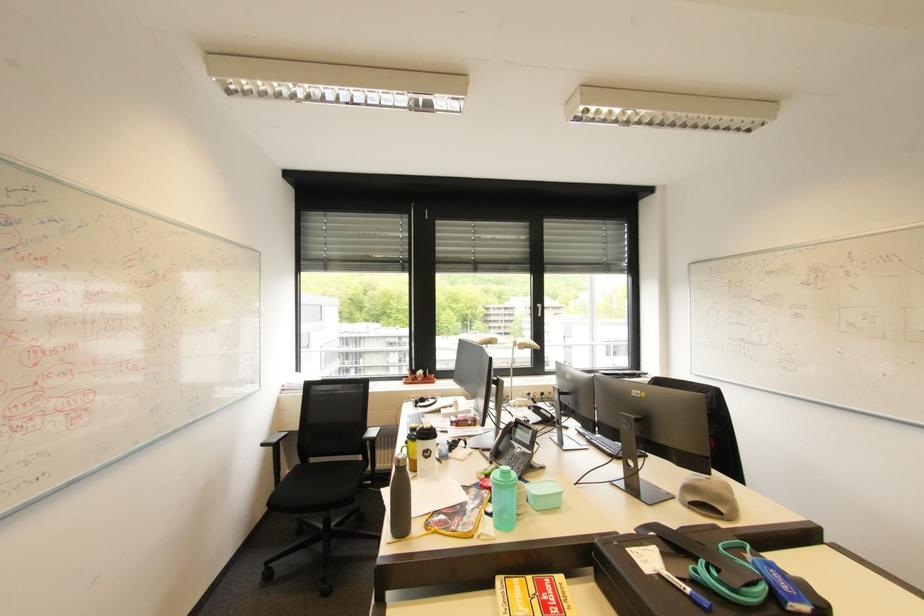
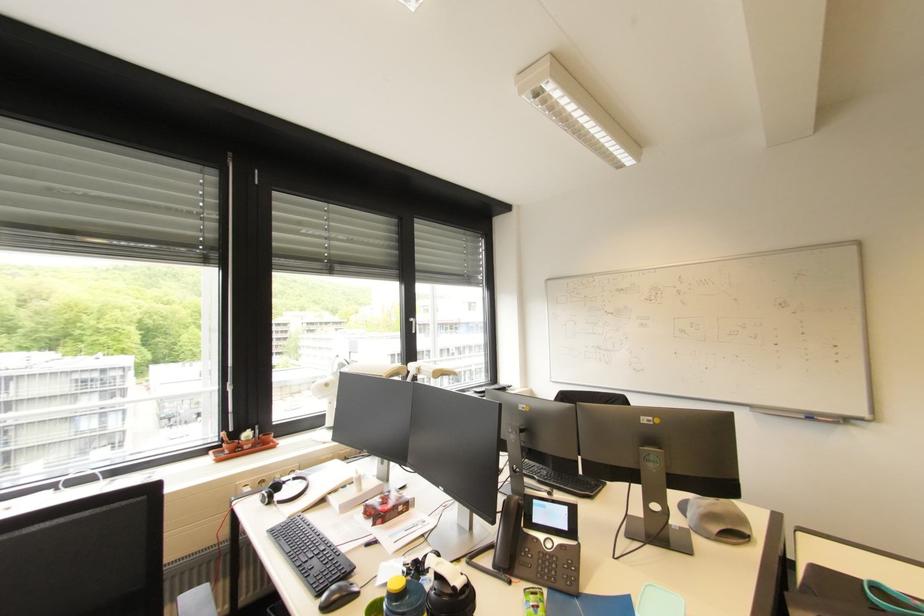
Where in the second image is the point corresponding to [537,432] from the first image?

(572, 509)